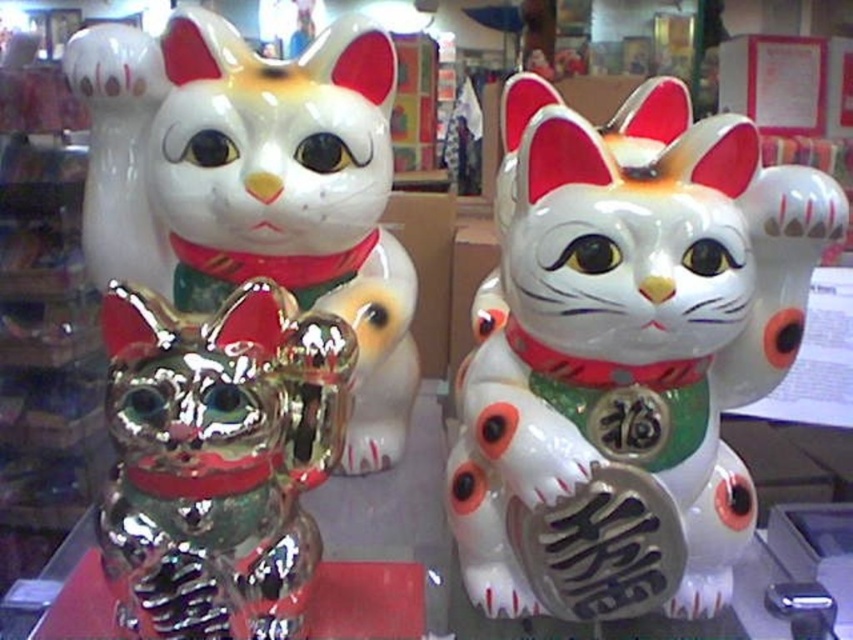
Is point (125, 449) farther from camera compared to point (184, 96)?

No, it is in front of (184, 96).

Does shiny metallic cat at center appear on the left side of shiny metallic cat at left?

Indeed, shiny metallic cat at center is positioned on the left side of shiny metallic cat at left.

Does point (163, 460) come farther from viewer compared to point (364, 291)?

No, it is in front of (364, 291).

This screenshot has height=640, width=853. Identify the location of shiny metallic cat at center. (218, 458).

Between white glossy ceramic cat at center and shiny metallic cat at center, which one is positioned higher?

Positioned higher is white glossy ceramic cat at center.

Who is more distant from viewer, (497, 484) or (140, 624)?

The point (497, 484) is more distant.

This screenshot has height=640, width=853. Describe the element at coordinates (625, 353) in the screenshot. I see `white glossy ceramic cat at center` at that location.

Locate an element on the screen. The width and height of the screenshot is (853, 640). white glossy ceramic cat at center is located at coordinates (625, 353).

Is white glossy ceramic cat at center above shiny metallic cat at left?

No.

Describe the element at coordinates (625, 353) in the screenshot. I see `white glossy ceramic cat at center` at that location.

From the picture: Who is more forward, (x=556, y=124) or (x=344, y=228)?

Point (x=556, y=124) is in front.

Locate an element on the screen. The height and width of the screenshot is (640, 853). white glossy ceramic cat at center is located at coordinates (625, 353).